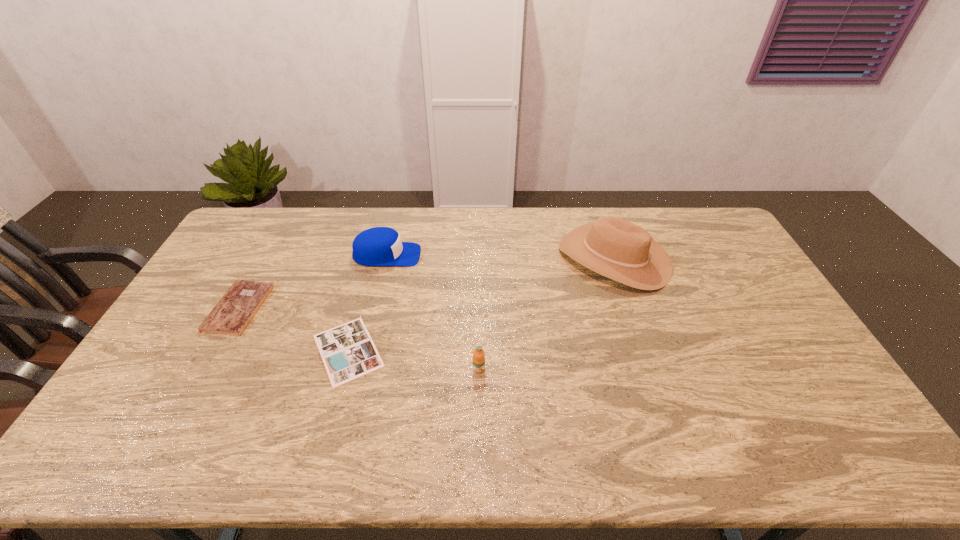
In order to click on blank space located 0.260m on the right of the Bible in this screenshot , I will do `click(347, 308)`.

Locate an element on the screen. This screenshot has height=540, width=960. free region located 0.400m on the left of the book is located at coordinates click(x=169, y=350).

At what (x,y) coordinates should I click in order to perform the action: click on cowboy hat present at the far edge. Please return your answer as a coordinate pair (x, y). This screenshot has width=960, height=540. Looking at the image, I should click on tap(611, 246).

Locate an element on the screen. The image size is (960, 540). baseball cap present at the far edge is located at coordinates coord(379,246).

You are a GUI agent. You are given a task and a screenshot of the screen. Output one action in this format:
    pyautogui.click(x=<x>, y=<y>)
    Task: Click on the object at the left edge
    
    Given the screenshot: What is the action you would take?
    pyautogui.click(x=232, y=314)

Image resolution: width=960 pixels, height=540 pixels. I want to click on vacant region at the far edge of the desktop, so click(671, 222).

I want to click on vacant area at the left edge, so [245, 275].

The height and width of the screenshot is (540, 960). Find the location of `blank space at the right edge`. blank space at the right edge is located at coordinates (743, 327).

This screenshot has width=960, height=540. I want to click on vacant space at the near left corner of the desktop, so click(x=122, y=450).

The width and height of the screenshot is (960, 540). I want to click on vacant area between the book and the fourth tallest object, so click(x=294, y=329).